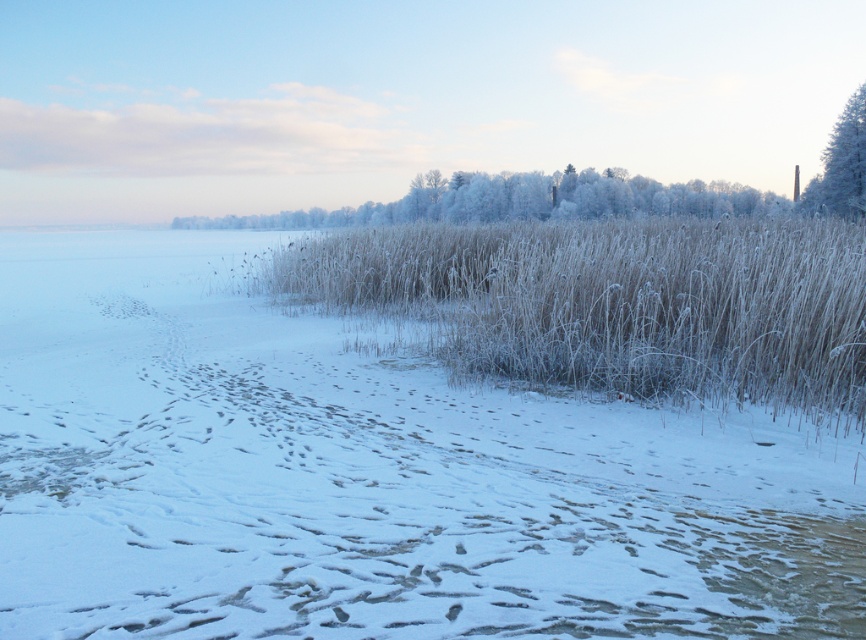
Question: Is the position of white frosty grass at center more distant than that of frosted grass at center?

Choices:
 (A) yes
 (B) no

Answer: (B)

Question: Does white frosty grass at center have a larger size compared to frosted white trees at upper center?

Choices:
 (A) no
 (B) yes

Answer: (A)

Question: Which point appears closest to the camera in this image?

Choices:
 (A) (841, 156)
 (B) (580, 369)
 (C) (564, 458)

Answer: (C)

Question: Among these points, which one is farthest from the camera?

Choices:
 (A) (818, 298)
 (B) (651, 188)

Answer: (B)

Question: Is frosted grass at center in front of white frosty tree at upper right?

Choices:
 (A) no
 (B) yes

Answer: (B)

Question: Which object is the farthest from the frosted grass at center?

Choices:
 (A) white frosty tree at upper right
 (B) frosted white trees at upper center

Answer: (B)